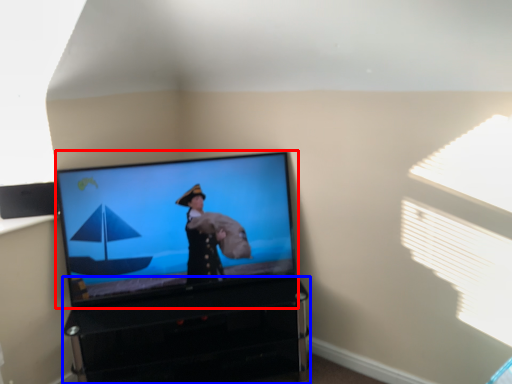
Question: Which object is further to the camera taking this photo, television (highlighted by a red box) or furniture (highlighted by a blue box)?

Choices:
 (A) television
 (B) furniture

Answer: (A)